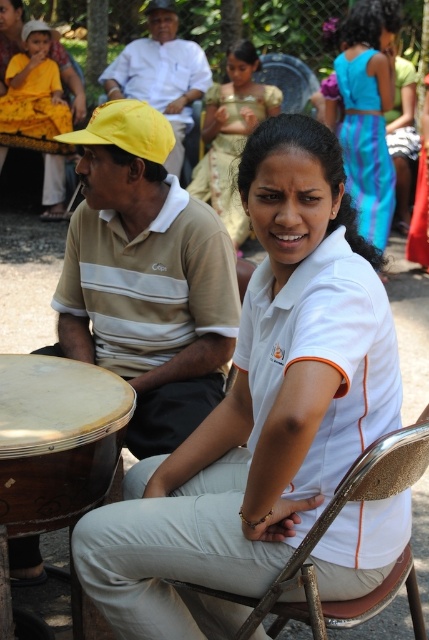
You are standing at the origin of the coordinate system in the image. Which of the two points, point [422,433] or point [380,67], is closer to you?

Point [422,433] is in front of point [380,67], so it is closer to you.

You are a photographer at a cultural event and need to capture a photo that includes both the wooden drum at lower left and the gold satin sari at center. Based on their positions, which object should you adjust your camera angle to focus on first to ensure both are in frame?

The wooden drum at lower left is below the gold satin sari at center, so you should adjust your camera angle to focus on the gold satin sari at center first to ensure both are in frame.